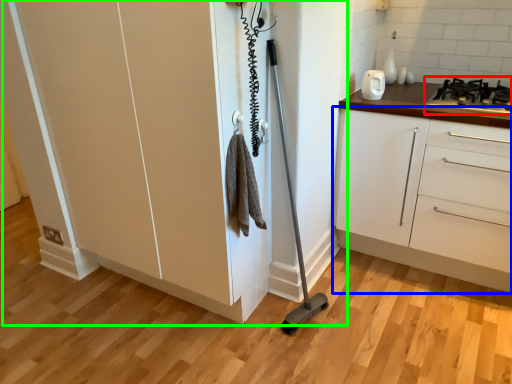
Question: Which object is the closest to the gas stove (highlighted by a red box)? Choose among these: cabinetry (highlighted by a blue box) or cupboard (highlighted by a green box).

Choices:
 (A) cabinetry
 (B) cupboard

Answer: (A)